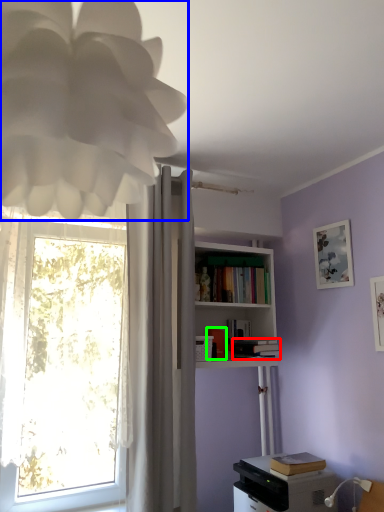
Question: Which is farther away from book (highlighted by a red box)? lamp (highlighted by a blue box) or book (highlighted by a green box)?

Choices:
 (A) lamp
 (B) book

Answer: (A)